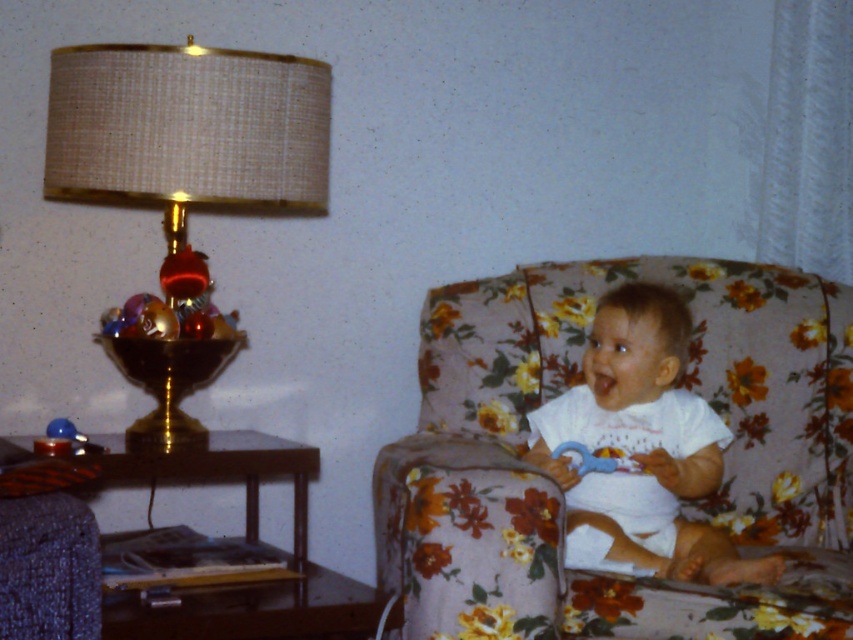
Question: Where is floral fabric couch at center located in relation to gold metallic lampshade at upper left in the image?

Choices:
 (A) left
 (B) right

Answer: (B)

Question: Considering the relative positions of floral fabric couch at center and white cotton baby at center in the image provided, where is floral fabric couch at center located with respect to white cotton baby at center?

Choices:
 (A) below
 (B) above

Answer: (A)

Question: Which point is closer to the camera?

Choices:
 (A) white cotton baby at center
 (B) gold metallic lampshade at upper left
 (C) floral fabric couch at center

Answer: (C)

Question: Which object is farther from the camera taking this photo?

Choices:
 (A) gold metallic lampshade at upper left
 (B) floral fabric couch at center

Answer: (A)

Question: Is gold metallic lampshade at upper left further to camera compared to white cotton baby at center?

Choices:
 (A) no
 (B) yes

Answer: (A)

Question: Among these points, which one is nearest to the camera?

Choices:
 (A) (833, 330)
 (B) (646, 449)
 (C) (132, 147)

Answer: (C)